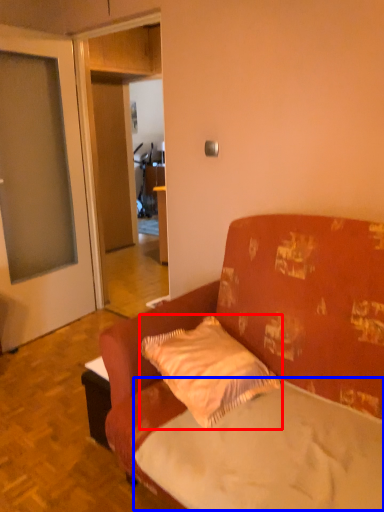
Question: Which object appears closest to the camera in this image, pillow (highlighted by a red box) or mattress (highlighted by a blue box)?

Choices:
 (A) pillow
 (B) mattress

Answer: (B)